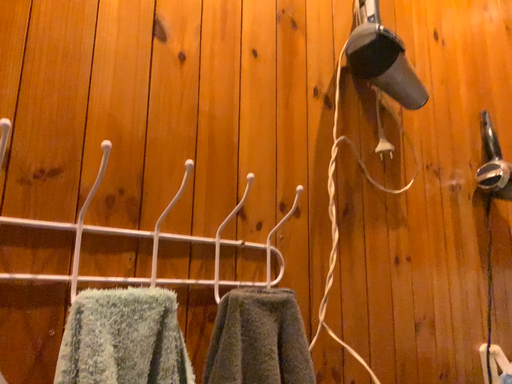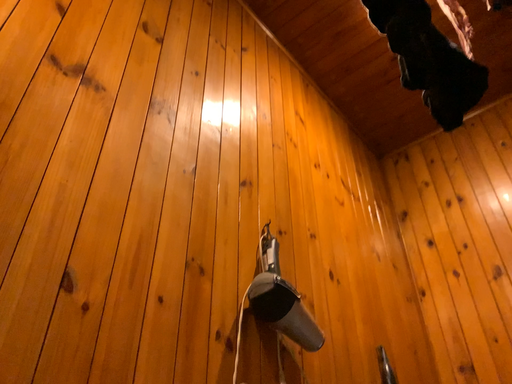
Question: Which way did the camera rotate in the video?

Choices:
 (A) rotated right
 (B) rotated left

Answer: (A)